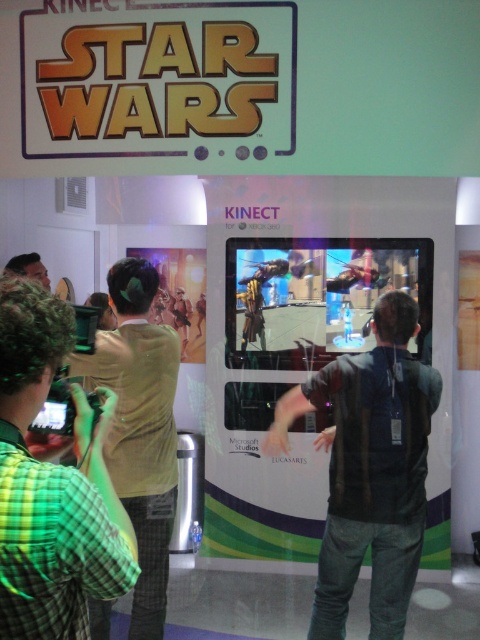
Question: Observing the image, what is the correct spatial positioning of dark gray vest at center in reference to light brown shirt at center?

Choices:
 (A) below
 (B) above

Answer: (A)

Question: Which object is positioned farthest from the green plaid shirt at left?

Choices:
 (A) light brown shirt at center
 (B) dark gray vest at center

Answer: (B)

Question: Which point is closer to the camera taking this photo?

Choices:
 (A) (325, 401)
 (B) (36, 506)

Answer: (B)

Question: Can you confirm if dark gray vest at center is positioned to the right of light brown shirt at center?

Choices:
 (A) no
 (B) yes

Answer: (B)

Question: Among these points, which one is nearest to the camera?

Choices:
 (A) (139, 483)
 (B) (110, 400)
 (C) (348, 435)

Answer: (B)

Question: Is green plaid shirt at left further to the viewer compared to light brown shirt at center?

Choices:
 (A) yes
 (B) no

Answer: (B)